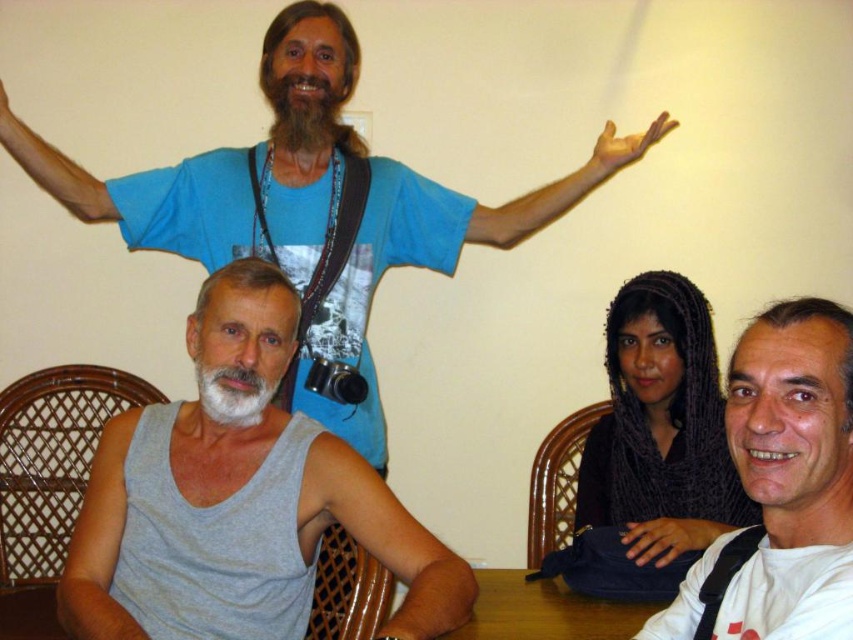
You are standing in front of the table and want to place a small object on the table. You have two points to choose from on the table surface. The first point is labeled as point [276,424] and the second point is labeled as point [438,620]. Which point is closer to you?

Point [276,424] is closer to you because it is further to the camera than point [438,620].

Based on the photo, you are a photographer adjusting the camera focus. You need to ensure both the dark gray knitted scarf at lower right and the white matte beard at lower left are in focus. Based on their positions, which object is wider and might require more careful framing to avoid being cut off?

The dark gray knitted scarf at lower right might be wider than the white matte beard at lower left, so it requires more careful framing to avoid being cut off.

Based on the photo, you are standing in front of the table where the two men are seated. There is a point at coordinates (654, 392) which is 1.84 meters away from you. If you want to place a small vase exactly at that point, will you be able to reach it without moving your position?

The point at coordinates (654, 392) is 1.84 meters away from you. Since the distance is manageable for reaching out, you can likely place the vase there without moving.